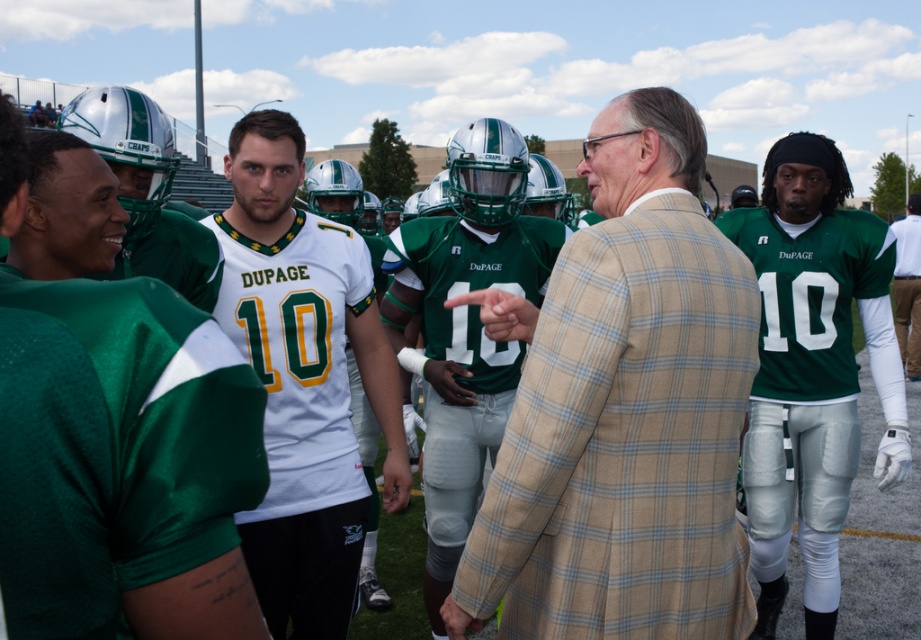
Based on the photo, you are a photographer trying to capture a photo of both the white mesh jersey at center and the green jersey at center. Based on their positions in the image, which jersey should you focus on first to ensure both are in frame?

The white mesh jersey at center has a lesser height compared to green jersey at center, so you should focus on the green jersey at center first to ensure both are in frame.

You are a photographer positioned at the back of the field. You want to take a photo of the white mesh jersey at center without the green mesh jersey at center blocking it. Is this possible based on their positions?

The green mesh jersey at center is in front of the white mesh jersey at center, so it would block the view of the white mesh jersey at center from your position at the back of the field. You cannot take a photo of the white mesh jersey at center without the green mesh jersey at center blocking it.

You are a photographer standing at the edge of the field. You want to take a photo of the white mesh jersey at center so that it is in focus while the background is blurred. Which camera setting should you choose to achieve this effect?

To blur the background and keep the white mesh jersey at center in focus, use a wide aperture setting. This will create a shallow depth of field, ensuring the subject is sharp while the background becomes out of focus.